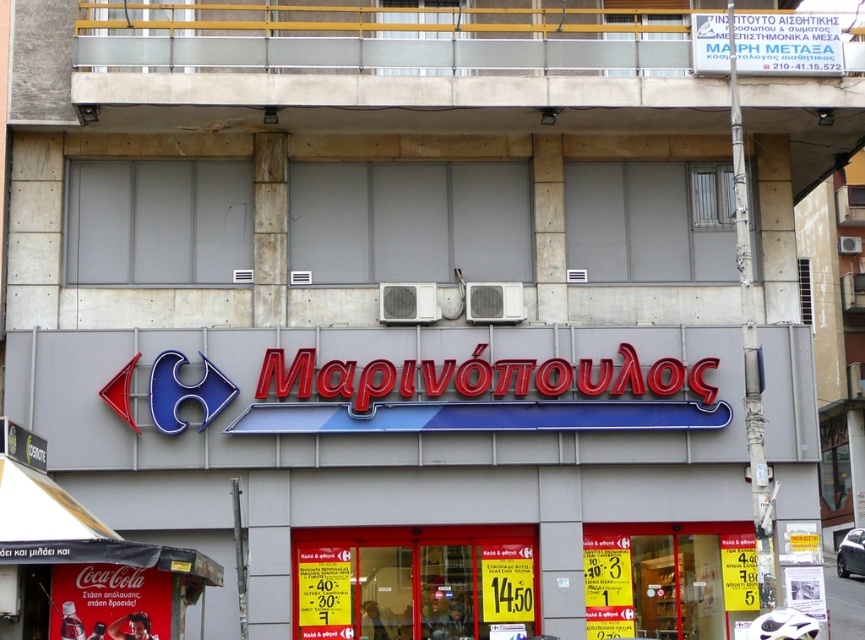
Question: Among these objects, which one is farthest from the camera?

Choices:
 (A) matte red coca-cola sign at lower left
 (B) red plastic sign at center
 (C) white plastic sign at upper center
 (D) yellow paper sign at center

Answer: (D)

Question: Is matte red coca-cola sign at lower left wider than red plastic sign at center?

Choices:
 (A) no
 (B) yes

Answer: (B)

Question: Can you confirm if white plastic sign at upper center is positioned above yellow paper sign at center?

Choices:
 (A) no
 (B) yes

Answer: (B)

Question: Does matte red coca-cola sign at lower left appear on the right side of white plastic sign at upper center?

Choices:
 (A) no
 (B) yes

Answer: (A)

Question: Which of the following is the closest to the observer?

Choices:
 (A) red plastic sign at center
 (B) yellow paper sign at center
 (C) white plastic sign at upper center

Answer: (C)

Question: Which object appears farthest from the camera in this image?

Choices:
 (A) red plastic sign at center
 (B) white plastic sign at upper center
 (C) yellow paper sign at center
 (D) matte red coca-cola sign at lower left

Answer: (C)